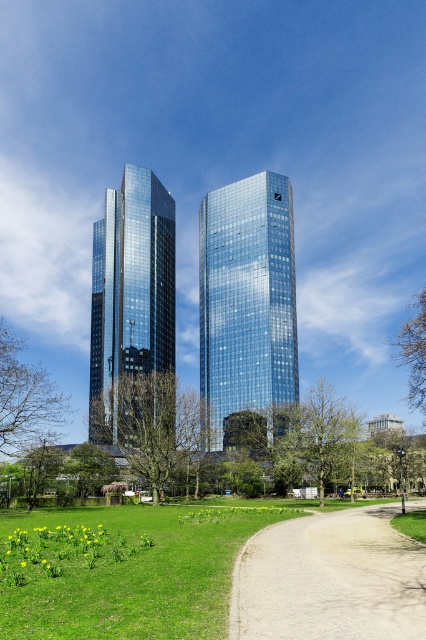
You are standing at the center of the park and want to find the green grass at lower left. According to the coordinates, where should you look relative to your position?

The green grass at lower left is located at coordinates point (x=123, y=570), so you should look towards the lower left direction from your current position at the center of the park.

You are standing at the point marked by the coordinate point [25,397] in the park. Looking towards the skyscrapers, which direction should you walk to reach the green leafy tree at left?

The point [25,397] corresponds to the location of the green leafy tree at left, so you are already at the tree.